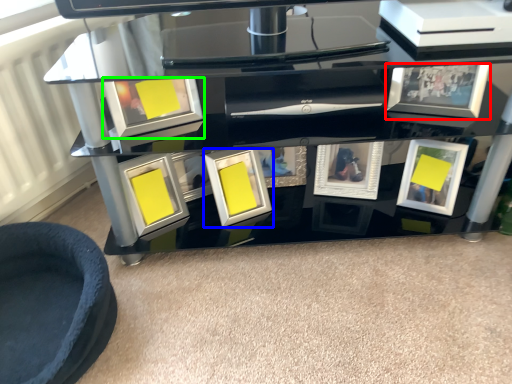
Question: Estimate the real-world distances between objects in this image. Which object is closer to picture frame (highlighted by a red box), picture frame (highlighted by a blue box) or picture frame (highlighted by a green box)?

Choices:
 (A) picture frame
 (B) picture frame

Answer: (A)